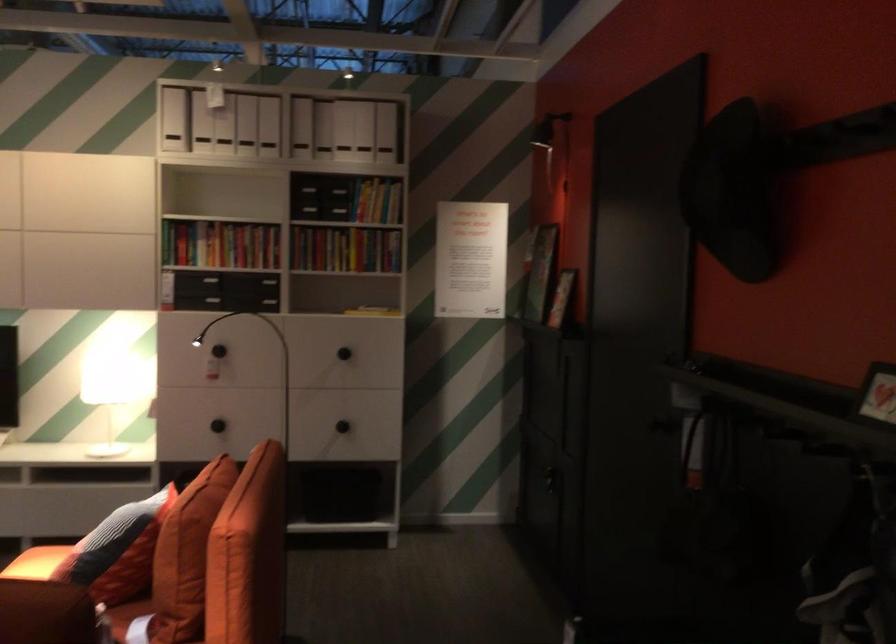
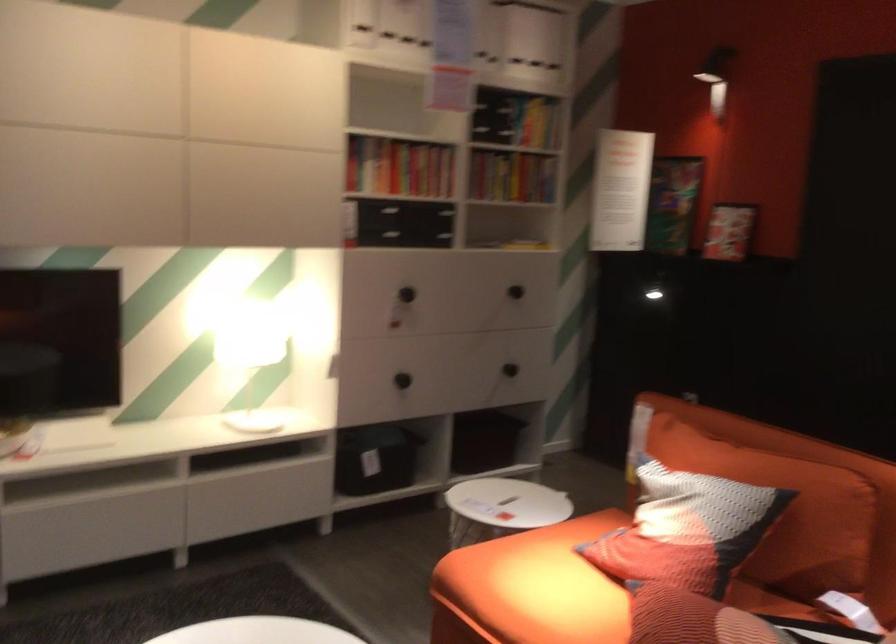
Where in the second image is the point corresponding to point 200,355 from the first image?

(407, 294)